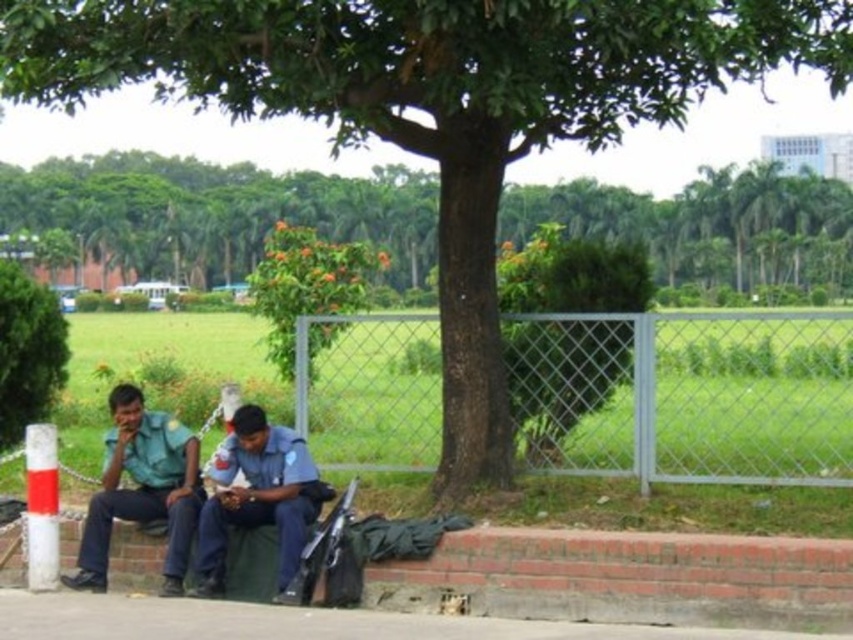
Question: In this image, where is metallic chain-link fence at center located relative to brick at lower left?

Choices:
 (A) above
 (B) below

Answer: (A)

Question: Among these points, which one is nearest to the camera?

Choices:
 (A) (225, 476)
 (B) (111, 397)

Answer: (A)

Question: Does metallic chain-link fence at center lie in front of gray concrete pavement at lower center?

Choices:
 (A) no
 (B) yes

Answer: (A)

Question: Which of the following is the closest to the observer?

Choices:
 (A) brick at lower left
 (B) blue uniform at center
 (C) green leafy tree at upper center
 (D) gray concrete pavement at lower center

Answer: (D)

Question: Is metallic chain-link fence at center below green leafy tree at upper center?

Choices:
 (A) yes
 (B) no

Answer: (A)

Question: Which object appears farthest from the camera in this image?

Choices:
 (A) gray concrete pavement at lower center
 (B) green leafy tree at upper center
 (C) green uniform at left

Answer: (B)